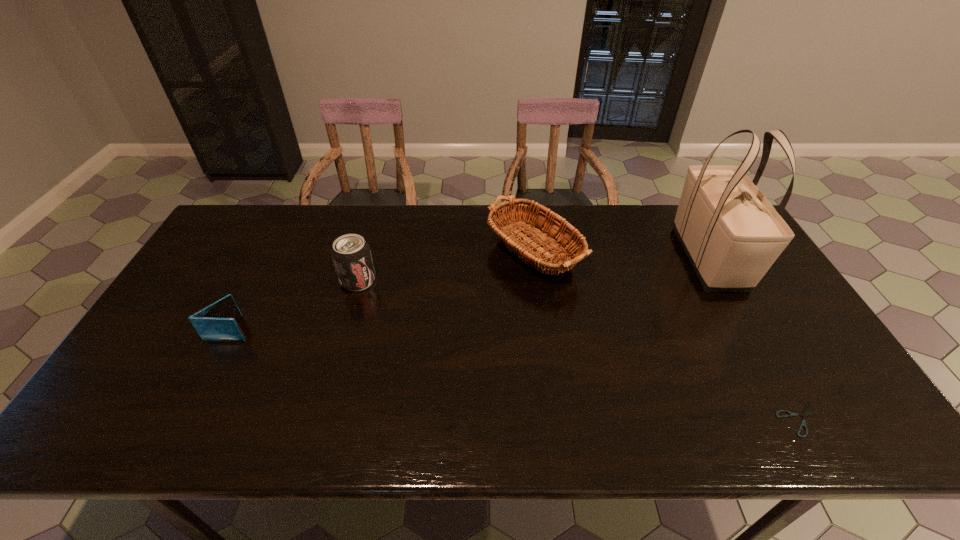
Find the location of a particular element. Image resolution: width=960 pixels, height=540 pixels. the tallest object is located at coordinates (732, 235).

What are the coordinates of `the third object from left to right` in the screenshot? It's located at (541, 227).

I want to click on soda can, so click(351, 255).

The width and height of the screenshot is (960, 540). In order to click on the second nearest object in this screenshot , I will do `click(217, 322)`.

I want to click on the leftmost object, so click(x=217, y=322).

The image size is (960, 540). I want to click on the shortest object, so click(x=803, y=423).

At what (x,y) coordinates should I click in order to perform the action: click on shears. Please return your answer as a coordinate pair (x, y). This screenshot has height=540, width=960. Looking at the image, I should click on (803, 423).

Where is `free region located with handles facing forward on the shopping bag`? The height and width of the screenshot is (540, 960). free region located with handles facing forward on the shopping bag is located at coordinates (799, 419).

This screenshot has width=960, height=540. What are the coordinates of `vacant space situated on the front of the basket` in the screenshot? It's located at (544, 355).

The width and height of the screenshot is (960, 540). In order to click on vacant space located 0.300m on the left of the soda can in this screenshot , I will do `click(240, 280)`.